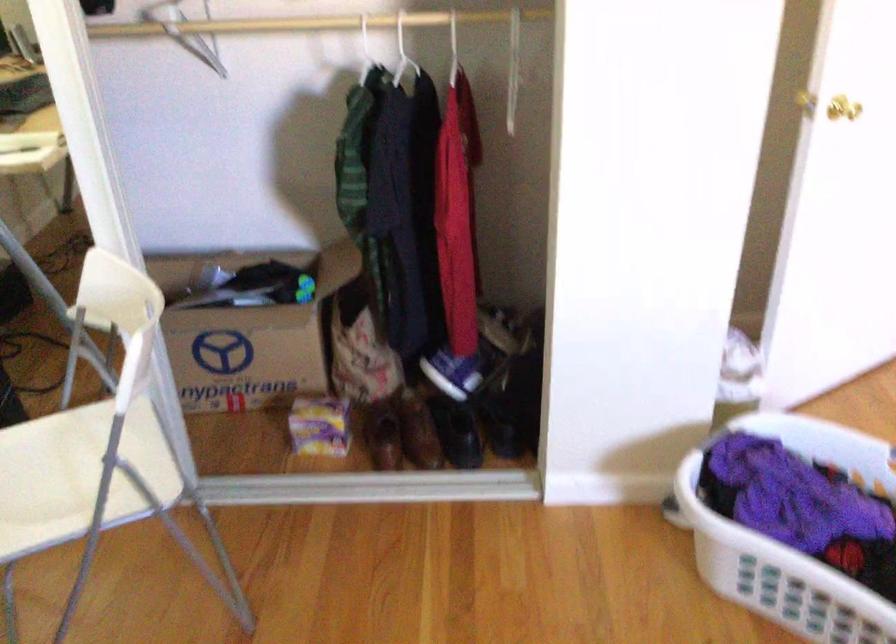
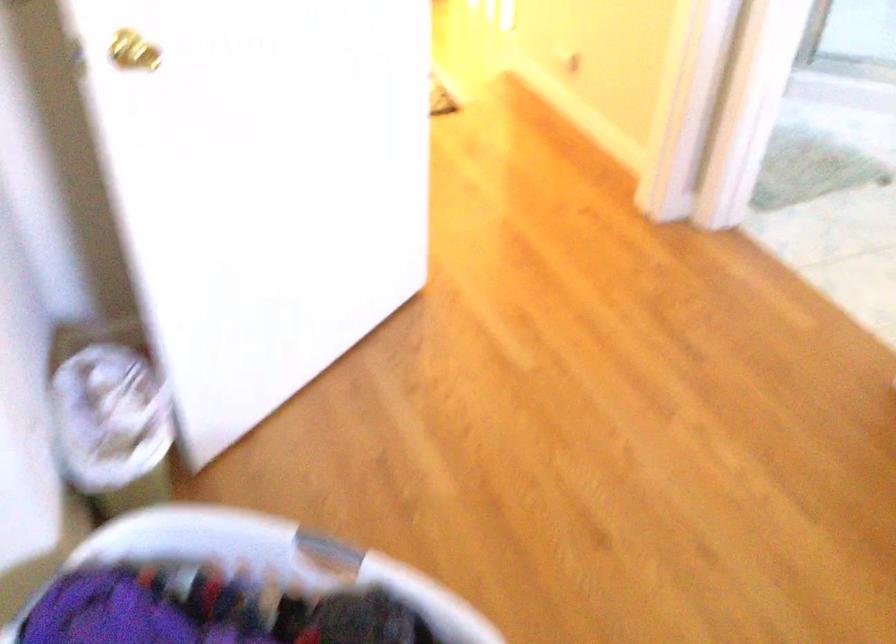
Question: How did the camera likely rotate?

Choices:
 (A) Left
 (B) Right
 (C) Up
 (D) Down

Answer: (B)